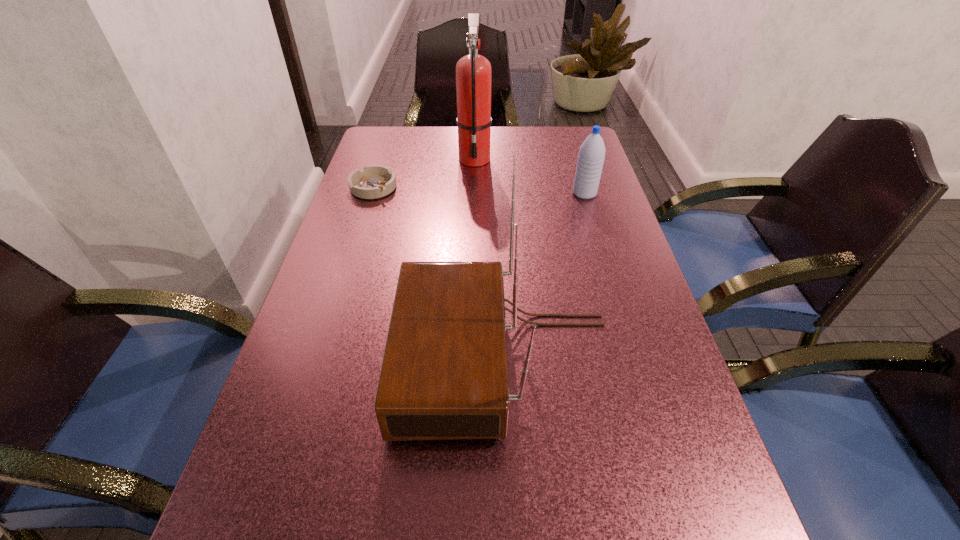
Where is `vacant area situated 0.130m on the front panel of the radio_receiver`? The height and width of the screenshot is (540, 960). vacant area situated 0.130m on the front panel of the radio_receiver is located at coordinates (331, 357).

Locate an element on the screen. This screenshot has height=540, width=960. free space located on the front of the water bottle is located at coordinates (612, 287).

This screenshot has width=960, height=540. In order to click on vacant region located on the front of the leftmost object in this screenshot , I will do `click(343, 286)`.

Identify the location of object that is positioned at the far edge. 473,72.

Identify the location of object present at the left edge. The height and width of the screenshot is (540, 960). (375, 181).

You are a GUI agent. You are given a task and a screenshot of the screen. Output one action in this format:
    pyautogui.click(x=<x>, y=<y>)
    Task: Click on the radio_receiver that is at the right edge
    
    Given the screenshot: What is the action you would take?
    tap(444, 376)

Identify the location of water bottle that is at the right edge. This screenshot has width=960, height=540. (591, 156).

In the image, there is a desktop. Where is `vacant space at the far edge`? The width and height of the screenshot is (960, 540). vacant space at the far edge is located at coordinates (511, 137).

Locate an element on the screen. The width and height of the screenshot is (960, 540). free space at the left edge of the desktop is located at coordinates (336, 261).

Find the location of a particular element. This screenshot has width=960, height=540. vacant space at the right edge of the desktop is located at coordinates (623, 280).